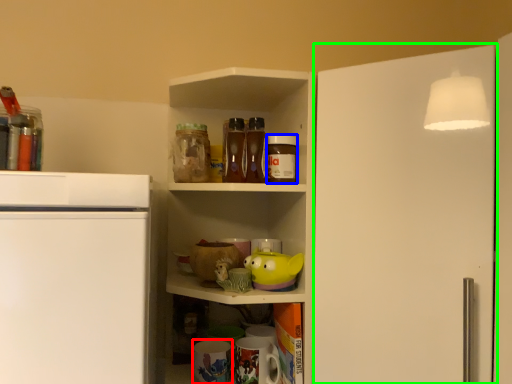
Question: Estimate the real-world distances between objects in this image. Which object is farther from appliance (highlighted by a red box), beverage (highlighted by a blue box) or door (highlighted by a green box)?

Choices:
 (A) beverage
 (B) door

Answer: (B)